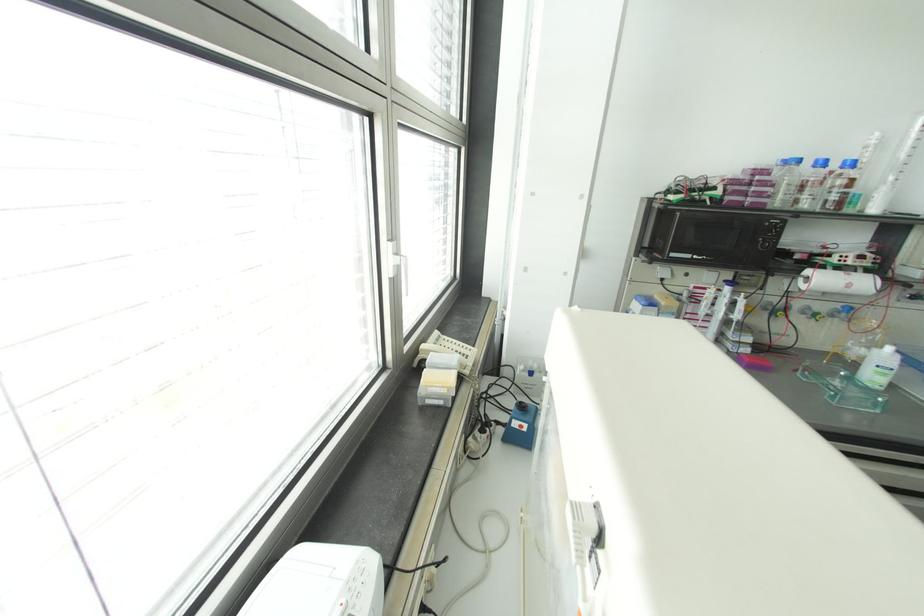
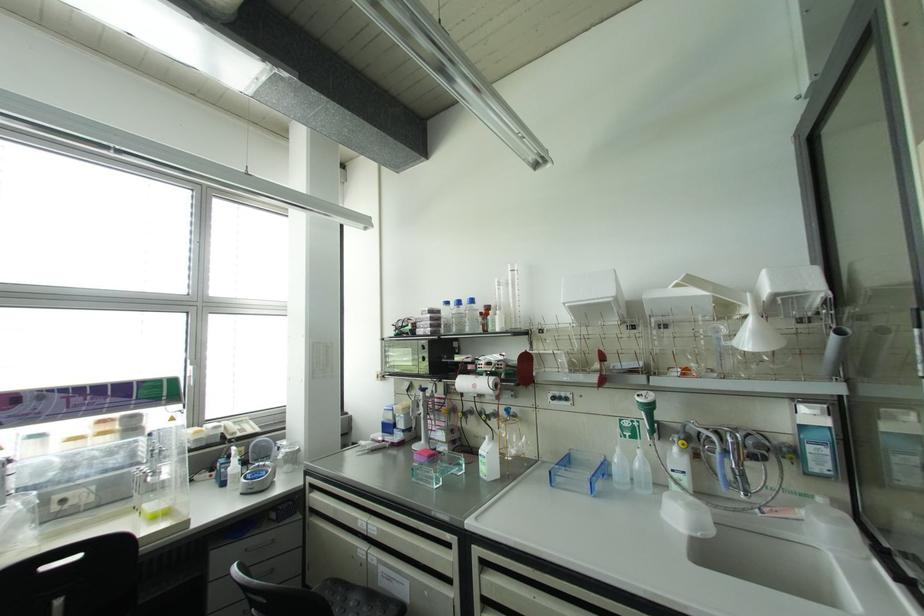
The point at (797,160) is marked in the first image. Where is the corresponding point in the second image?

(446, 302)